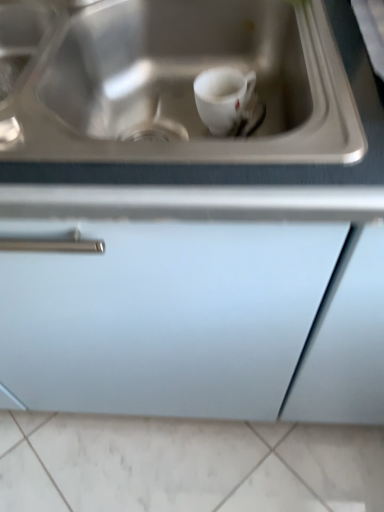
Where is `stainless steel sink at upper center`? stainless steel sink at upper center is located at coordinates (181, 86).

At what (x,y) coordinates should I click in order to perform the action: click on white marble tile at lower center. Please return your answer as a coordinate pair (x, y). The width and height of the screenshot is (384, 512). Looking at the image, I should click on (145, 461).

The height and width of the screenshot is (512, 384). What are the coordinates of `stainless steel sink at upper center` in the screenshot? It's located at (181, 86).

From a real-world perspective, is stainless steel sink at upper center positioned above or below white marble tile at lower center?

Clearly, from a real-world perspective, stainless steel sink at upper center is above white marble tile at lower center.

Can you tell me how much stainless steel sink at upper center and white marble tile at lower center differ in facing direction?

90.3 degrees.

Is stainless steel sink at upper center taller than white marble tile at lower center?

Yes.

Does stainless steel sink at upper center touch white marble tile at lower center?

No.

From a real-world perspective, is white glossy mug at center located higher than white marble tile at lower center?

Correct, in the physical world, white glossy mug at center is higher than white marble tile at lower center.

Between white glossy mug at center and white marble tile at lower center, which one appears on the left side from the viewer's perspective?

white marble tile at lower center is more to the left.

Is white glossy mug at center shorter than white marble tile at lower center?

Incorrect, the height of white glossy mug at center does not fall short of that of white marble tile at lower center.

Considering the relative sizes of white glossy mug at center and white marble tile at lower center in the image provided, is white glossy mug at center thinner than white marble tile at lower center?

Yes.

How many degrees apart are the facing directions of stainless steel sink at upper center and matte white cabinet at center?

The facing directions of stainless steel sink at upper center and matte white cabinet at center are 0.834 degrees apart.

Considering the sizes of stainless steel sink at upper center and matte white cabinet at center in the image, is stainless steel sink at upper center taller or shorter than matte white cabinet at center?

stainless steel sink at upper center is shorter than matte white cabinet at center.

From a real-world perspective, who is located lower, stainless steel sink at upper center or matte white cabinet at center?

matte white cabinet at center.

Is stainless steel sink at upper center looking in the opposite direction of matte white cabinet at center?

Yes, stainless steel sink at upper center is positioned with its back facing matte white cabinet at center.

Between point (60, 113) and point (213, 106), which one is positioned behind?

Positioned behind is point (213, 106).

Which of these two, stainless steel sink at upper center or white glossy mug at center, stands taller?

stainless steel sink at upper center is taller.

This screenshot has width=384, height=512. Find the location of `sink in front of the white glossy mug at center`. sink in front of the white glossy mug at center is located at coordinates (181, 86).

Could you tell me if matte white cabinet at center is turned towards stainless steel sink at upper center?

Yes, matte white cabinet at center is facing stainless steel sink at upper center.

In order to click on sink located behind the matte white cabinet at center in this screenshot , I will do `click(181, 86)`.

Does matte white cabinet at center have a lesser width compared to stainless steel sink at upper center?

Incorrect, the width of matte white cabinet at center is not less than that of stainless steel sink at upper center.

From the image's perspective, which is above, matte white cabinet at center or stainless steel sink at upper center?

stainless steel sink at upper center appears higher in the image.

Looking at this image, which of these two, white glossy mug at center or matte white cabinet at center, is bigger?

matte white cabinet at center is bigger.

Can you confirm if white glossy mug at center is shorter than matte white cabinet at center?

Yes, white glossy mug at center is shorter than matte white cabinet at center.

I want to click on cabinetry in front of the white glossy mug at center, so click(198, 303).

Based on the photo, considering the relative positions of white marble tile at lower center and matte white cabinet at center in the image provided, is white marble tile at lower center to the left of matte white cabinet at center from the viewer's perspective?

No, white marble tile at lower center is not to the left of matte white cabinet at center.

Is white marble tile at lower center positioned behind matte white cabinet at center?

Yes, it is.

What's the angular difference between white marble tile at lower center and matte white cabinet at center's facing directions?

There is a 89.5-degree angle between the facing directions of white marble tile at lower center and matte white cabinet at center.

The width and height of the screenshot is (384, 512). In order to click on sink above the white marble tile at lower center (from a real-world perspective) in this screenshot , I will do `click(181, 86)`.

Identify the location of tile below the white glossy mug at center (from the image's perspective). (145, 461).

Which object lies nearer to the anchor point stainless steel sink at upper center, white glossy mug at center or matte white cabinet at center?

white glossy mug at center.

When comparing their distances from white glossy mug at center, does stainless steel sink at upper center or matte white cabinet at center seem further?

Based on the image, matte white cabinet at center appears to be further to white glossy mug at center.

Which object lies nearer to the anchor point matte white cabinet at center, white glossy mug at center or stainless steel sink at upper center?

stainless steel sink at upper center lies closer to matte white cabinet at center than the other object.

Consider the image. Considering their positions, is white glossy mug at center positioned closer to white marble tile at lower center than matte white cabinet at center?

matte white cabinet at center.

Which object lies nearer to the anchor point white glossy mug at center, stainless steel sink at upper center or white marble tile at lower center?

Among the two, stainless steel sink at upper center is located nearer to white glossy mug at center.

Estimate the real-world distances between objects in this image. Which object is closer to matte white cabinet at center, white marble tile at lower center or white glossy mug at center?

white glossy mug at center lies closer to matte white cabinet at center than the other object.

Based on their spatial positions, is white marble tile at lower center or stainless steel sink at upper center further from matte white cabinet at center?

white marble tile at lower center lies further to matte white cabinet at center than the other object.

Which object lies nearer to the anchor point matte white cabinet at center, stainless steel sink at upper center or white glossy mug at center?

Based on the image, stainless steel sink at upper center appears to be nearer to matte white cabinet at center.

The width and height of the screenshot is (384, 512). In order to click on sink between matte white cabinet at center and white glossy mug at center from front to back in this screenshot , I will do `click(181, 86)`.

The image size is (384, 512). What are the coordinates of `cabinetry between white glossy mug at center and white marble tile at lower center from top to bottom` in the screenshot? It's located at (198, 303).

Image resolution: width=384 pixels, height=512 pixels. Find the location of `sink between white glossy mug at center and white marble tile at lower center from top to bottom`. sink between white glossy mug at center and white marble tile at lower center from top to bottom is located at coordinates (181, 86).

Image resolution: width=384 pixels, height=512 pixels. I want to click on cabinetry between stainless steel sink at upper center and white marble tile at lower center in the up-down direction, so tap(198, 303).